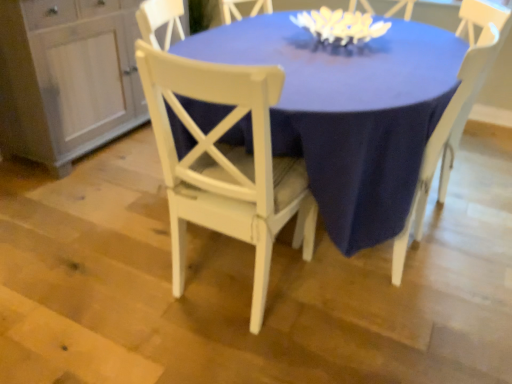
Question: Does matte white table at center have a larger size compared to white wood dresser at left?

Choices:
 (A) yes
 (B) no

Answer: (A)

Question: Can you see matte white table at center touching white wood dresser at left?

Choices:
 (A) yes
 (B) no

Answer: (B)

Question: From a real-world perspective, is matte white table at center physically above white wood dresser at left?

Choices:
 (A) yes
 (B) no

Answer: (B)

Question: Is matte white table at center not near white wood dresser at left?

Choices:
 (A) no
 (B) yes

Answer: (B)

Question: Considering the relative positions of matte white table at center and white wood dresser at left in the image provided, is matte white table at center to the left of white wood dresser at left from the viewer's perspective?

Choices:
 (A) yes
 (B) no

Answer: (B)

Question: Does matte white table at center lie behind white wood dresser at left?

Choices:
 (A) no
 (B) yes

Answer: (A)

Question: Is white matte floral arrangement at upper center to the left of white wood chair at center, positioned as the 1th chair in left-to-right order, from the viewer's perspective?

Choices:
 (A) yes
 (B) no

Answer: (B)

Question: From the image's perspective, is white matte floral arrangement at upper center under white wood chair at center, the second chair when ordered from right to left?

Choices:
 (A) no
 (B) yes

Answer: (A)

Question: Can you confirm if white matte floral arrangement at upper center is taller than white wood chair at center, positioned as the 1th chair in left-to-right order?

Choices:
 (A) yes
 (B) no

Answer: (B)

Question: Can you confirm if white matte floral arrangement at upper center is wider than white wood chair at center, the second chair when ordered from right to left?

Choices:
 (A) no
 (B) yes

Answer: (A)

Question: Does white matte floral arrangement at upper center have a smaller size compared to white wood chair at center, the second chair when ordered from right to left?

Choices:
 (A) no
 (B) yes

Answer: (B)

Question: Would you consider white matte floral arrangement at upper center to be distant from white wood chair at center, positioned as the 1th chair in left-to-right order?

Choices:
 (A) no
 (B) yes

Answer: (A)

Question: From a real-world perspective, does white wood chair at center, the second chair when ordered from right to left, stand above matte white table at center?

Choices:
 (A) yes
 (B) no

Answer: (A)